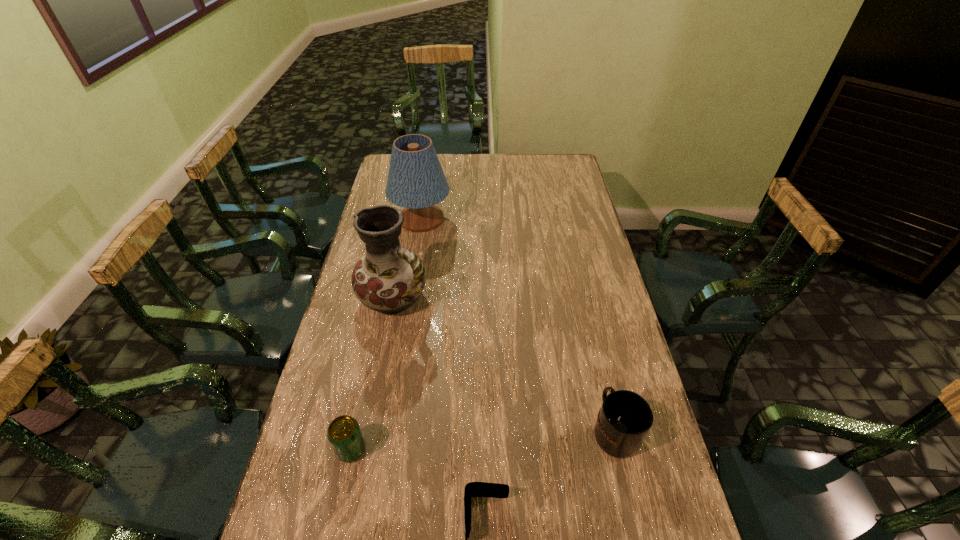
Identify the location of vacant space in between the fourth nearest object and the beer can. (372, 374).

Identify the location of empty space that is in between the rightmost object and the vase. (505, 364).

Find the location of a particular element. free space between the farthest object and the beer can is located at coordinates (386, 334).

Find the location of a particular element. This screenshot has height=540, width=960. vacant area that lies between the beer can and the rightmost object is located at coordinates (483, 440).

Identify the location of free space between the beer can and the vase. Image resolution: width=960 pixels, height=540 pixels. (372, 374).

You are a GUI agent. You are given a task and a screenshot of the screen. Output one action in this format:
    pyautogui.click(x=<x>, y=<y>)
    Task: Click on the free point between the beer can and the farthest object
    
    Given the screenshot: What is the action you would take?
    pyautogui.click(x=386, y=334)

The width and height of the screenshot is (960, 540). Find the location of `free space that is in between the vase and the rightmost object`. free space that is in between the vase and the rightmost object is located at coordinates (505, 364).

The image size is (960, 540). In order to click on the second closest object relative to the beer can in this screenshot , I will do `click(389, 279)`.

Where is `the second closest object to the rightmost object`? Image resolution: width=960 pixels, height=540 pixels. the second closest object to the rightmost object is located at coordinates (389, 279).